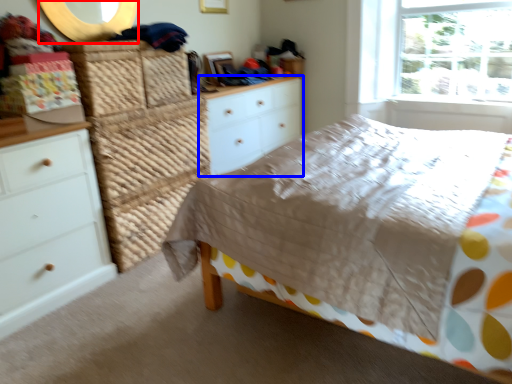
Question: Which object is further to the camera taking this photo, mirror (highlighted by a red box) or chest of drawers (highlighted by a blue box)?

Choices:
 (A) mirror
 (B) chest of drawers

Answer: (B)